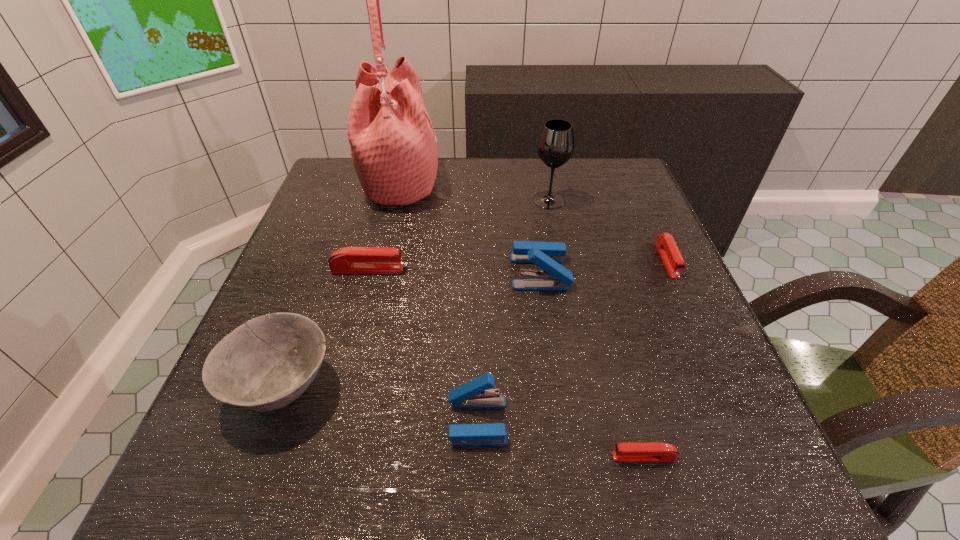
Locate an element on the screen. The image size is (960, 540). the tallest object is located at coordinates point(393,145).

Identify the location of wineglass. (556, 143).

Locate an element on the screen. Image resolution: width=960 pixels, height=540 pixels. gray wineglass is located at coordinates (556, 143).

What are the coordinates of `the bigger blue stapler` in the screenshot? It's located at (547, 255).

The width and height of the screenshot is (960, 540). I want to click on the third stapler from left to right, so click(x=547, y=255).

At what (x,y) coordinates should I click in order to perform the action: click on bowl. Please return your answer as a coordinate pair (x, y). The image size is (960, 540). Looking at the image, I should click on (265, 364).

Find the location of a particular element. Image resolution: width=960 pixels, height=540 pixels. the fourth object from left to right is located at coordinates (474, 394).

Locate an element on the screen. This screenshot has width=960, height=540. the second stapler from left to right is located at coordinates coord(474,394).

Identify the location of the third shortest stapler. The height and width of the screenshot is (540, 960). (349, 260).

At what (x,y) coordinates should I click in order to perform the action: click on the leftmost red stapler. Please return your answer as a coordinate pair (x, y). Looking at the image, I should click on (349, 260).